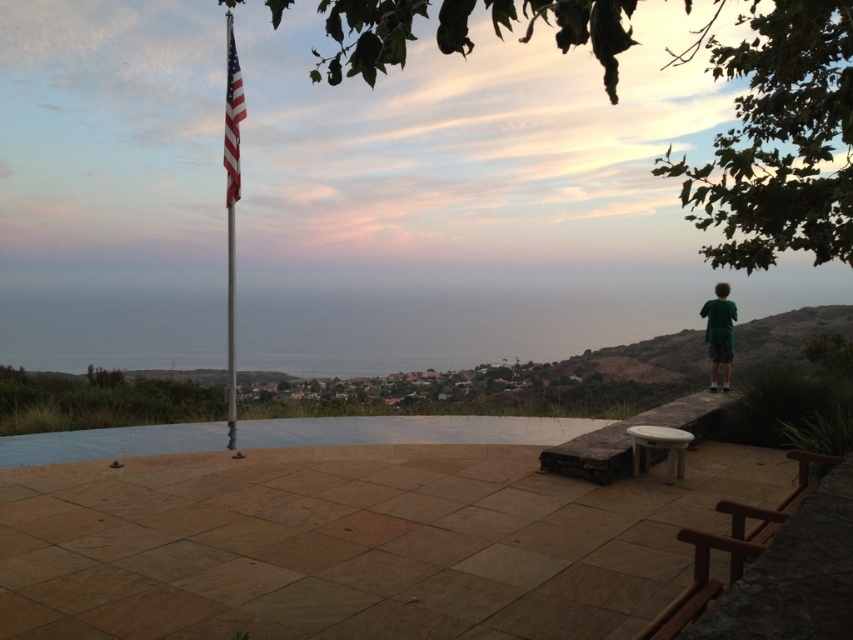
Question: Among these objects, which one is farthest from the camera?

Choices:
 (A) polished metal flag pole at center-left
 (B) metallic flagpole at upper left
 (C) american flag at upper left

Answer: (B)

Question: Does polished metal flag pole at center-left appear over american flag at upper left?

Choices:
 (A) yes
 (B) no

Answer: (B)

Question: Which point appears farthest from the camera in this image?

Choices:
 (A) (227, 84)
 (B) (234, 145)
 (C) (721, 328)

Answer: (C)

Question: Which point appears closest to the camera in this image?

Choices:
 (A) (721, 305)
 (B) (225, 131)
 (C) (239, 90)

Answer: (C)

Question: Is polished metal flag pole at center-left below metallic flagpole at upper left?

Choices:
 (A) yes
 (B) no

Answer: (B)

Question: Where is polished metal flag pole at center-left located in relation to american flag at upper left in the image?

Choices:
 (A) above
 (B) below

Answer: (B)